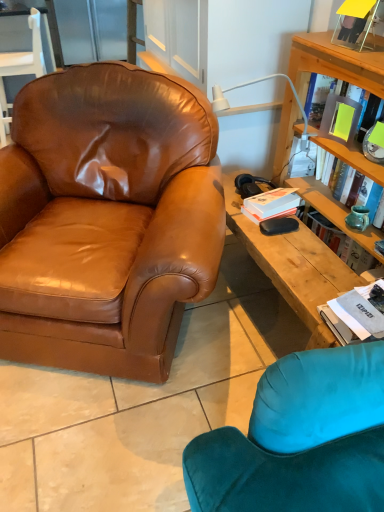
Question: Is white plastic lamp at upper right looking in the opposite direction of white paper book at right, acting as the 1th book starting from the front?

Choices:
 (A) yes
 (B) no

Answer: (B)

Question: Does white plastic lamp at upper right appear on the right side of white paper book at right, which appears as the 2th book when viewed from the top?

Choices:
 (A) no
 (B) yes

Answer: (A)

Question: Is white plastic lamp at upper right positioned in front of white paper book at right, which appears as the 2th book when viewed from the top?

Choices:
 (A) no
 (B) yes

Answer: (A)

Question: Can you confirm if white plastic lamp at upper right is bigger than white paper book at right, which is counted as the 1th book, starting from the bottom?

Choices:
 (A) yes
 (B) no

Answer: (A)

Question: Considering the relative sizes of white plastic lamp at upper right and white paper book at right, which is counted as the 1th book, starting from the bottom, in the image provided, is white plastic lamp at upper right shorter than white paper book at right, which is counted as the 1th book, starting from the bottom,?

Choices:
 (A) yes
 (B) no

Answer: (B)

Question: From a real-world perspective, is white plastic lamp at upper right positioned over white paper book at right, which appears as the 2th book when viewed from the top, based on gravity?

Choices:
 (A) yes
 (B) no

Answer: (A)

Question: Is brown leather chair at left, the 1th chair ordered from the bottom, positioned with its back to white paper book at right, acting as the 1th book starting from the front?

Choices:
 (A) no
 (B) yes

Answer: (A)

Question: Is brown leather chair at left, the 1th chair in the front-to-back sequence, closer to the viewer compared to white paper book at right, which is counted as the 1th book, starting from the bottom?

Choices:
 (A) yes
 (B) no

Answer: (A)

Question: Is white paper book at right, acting as the 1th book starting from the front, surrounded by brown leather chair at left, which is counted as the 2th chair, starting from the top?

Choices:
 (A) yes
 (B) no

Answer: (B)

Question: From a real-world perspective, is brown leather chair at left, which is counted as the 2th chair, starting from the top, positioned over white paper book at right, acting as the 1th book starting from the front, based on gravity?

Choices:
 (A) no
 (B) yes

Answer: (B)

Question: Considering the relative sizes of brown leather chair at left, which is counted as the 2th chair, starting from the top, and white paper book at right, which is counted as the 1th book, starting from the bottom, in the image provided, is brown leather chair at left, which is counted as the 2th chair, starting from the top, taller than white paper book at right, which is counted as the 1th book, starting from the bottom,?

Choices:
 (A) no
 (B) yes

Answer: (B)

Question: Is brown leather chair at left, the 1th chair in the front-to-back sequence, wider than white paper book at right, which appears as the 2th book when viewed from the top?

Choices:
 (A) no
 (B) yes

Answer: (B)

Question: Can you confirm if brown leather armchair at upper left, marked as the second chair in a front-to-back arrangement, is wider than yellow matte book at upper right, the 1th book when ordered from back to front?

Choices:
 (A) no
 (B) yes

Answer: (B)